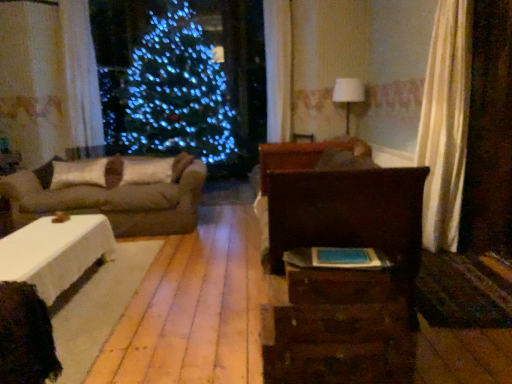
Question: Can you confirm if white sheer curtain at upper left is positioned to the left of wooden drawer at lower right?

Choices:
 (A) no
 (B) yes

Answer: (B)

Question: Does white sheer curtain at upper left have a greater width compared to wooden drawer at lower right?

Choices:
 (A) no
 (B) yes

Answer: (A)

Question: Is the surface of white sheer curtain at upper left in direct contact with wooden drawer at lower right?

Choices:
 (A) no
 (B) yes

Answer: (A)

Question: Is white sheer curtain at upper left facing away from wooden drawer at lower right?

Choices:
 (A) yes
 (B) no

Answer: (B)

Question: Does white sheer curtain at upper left have a smaller size compared to wooden drawer at lower right?

Choices:
 (A) yes
 (B) no

Answer: (B)

Question: Is wooden drawer at lower right completely or partially inside white sheer curtain at upper left?

Choices:
 (A) no
 (B) yes

Answer: (A)

Question: Is wooden drawer at lower right further to the viewer compared to white fabric lampshade at upper center?

Choices:
 (A) no
 (B) yes

Answer: (A)

Question: Could you tell me if wooden drawer at lower right is facing white fabric lampshade at upper center?

Choices:
 (A) yes
 (B) no

Answer: (B)

Question: Can you confirm if wooden drawer at lower right is positioned to the left of white fabric lampshade at upper center?

Choices:
 (A) yes
 (B) no

Answer: (A)

Question: Is wooden drawer at lower right not close to white fabric lampshade at upper center?

Choices:
 (A) no
 (B) yes

Answer: (B)

Question: From a real-world perspective, is wooden drawer at lower right positioned under white fabric lampshade at upper center based on gravity?

Choices:
 (A) yes
 (B) no

Answer: (A)

Question: From the image's perspective, is wooden drawer at lower right above white fabric lampshade at upper center?

Choices:
 (A) no
 (B) yes

Answer: (A)

Question: Can you confirm if rustic wood dresser at center is thinner than wooden drawer at lower right?

Choices:
 (A) no
 (B) yes

Answer: (A)